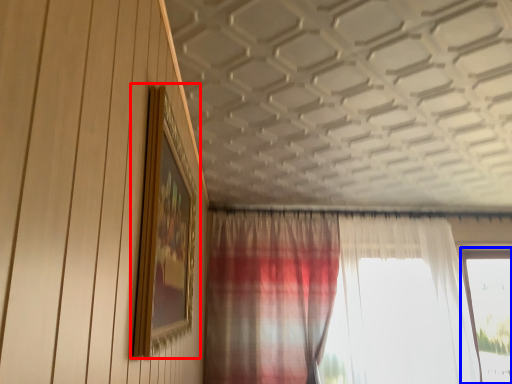
Question: Which point is closer to the camera, picture frame (highlighted by a red box) or window (highlighted by a blue box)?

Choices:
 (A) picture frame
 (B) window

Answer: (A)